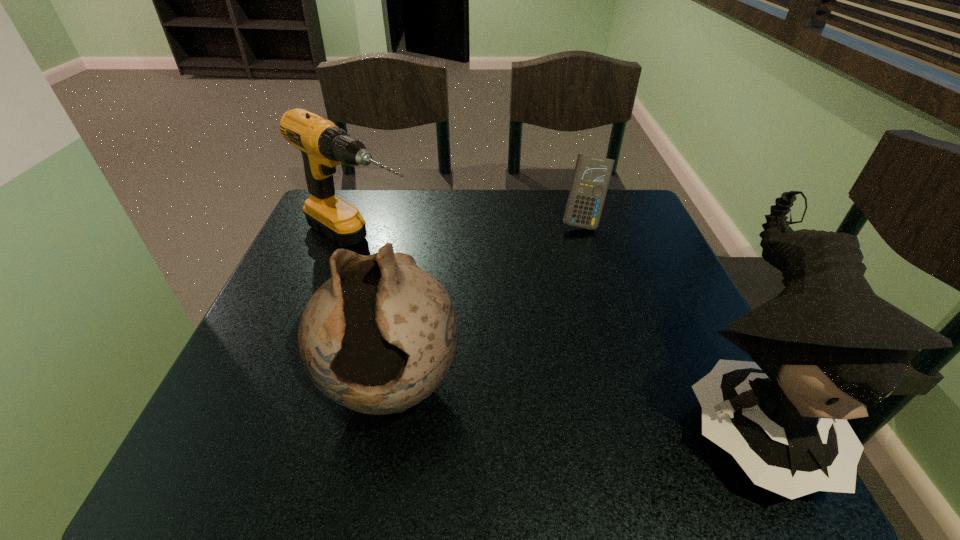
Where is `pottery`? The height and width of the screenshot is (540, 960). pottery is located at coordinates (378, 337).

Image resolution: width=960 pixels, height=540 pixels. I want to click on doll, so point(824,349).

Find the location of a particular element. This screenshot has width=960, height=540. calculator is located at coordinates (592, 174).

Locate an element on the screen. The height and width of the screenshot is (540, 960). drill is located at coordinates pos(323,145).

Locate an element on the screen. blank space located on the front-facing side of the shortest object is located at coordinates (590, 346).

Find the location of a particular element. free region located on the front-facing side of the shortest object is located at coordinates (587, 293).

The height and width of the screenshot is (540, 960). In order to click on blank space located on the front-facing side of the shortest object in this screenshot , I will do `click(584, 248)`.

Image resolution: width=960 pixels, height=540 pixels. What are the coordinates of `vacant space located at the tip of the drill` in the screenshot? It's located at (506, 332).

The image size is (960, 540). What are the coordinates of `vacant space located at the tip of the drill` in the screenshot? It's located at click(x=444, y=293).

Locate an element on the screen. vacant space located 0.080m at the tip of the drill is located at coordinates (427, 283).